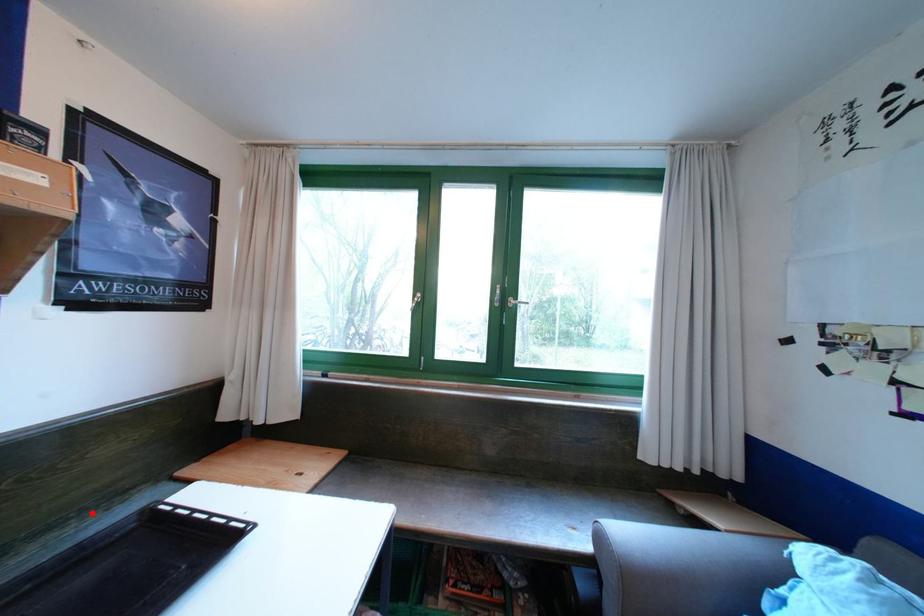
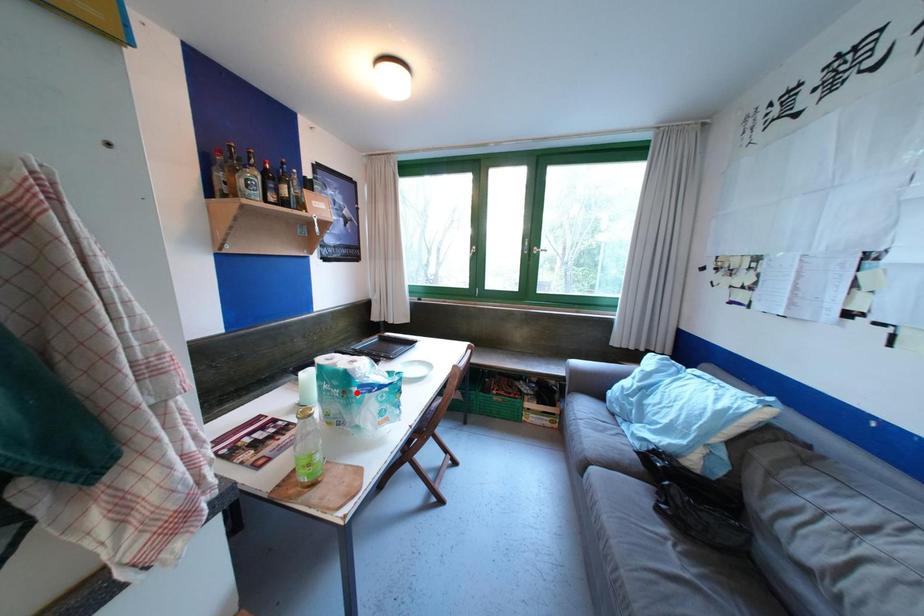
I am providing you with two images of the same scene from different viewpoints. A red point is marked on the first image and another point is marked on the second image. Is the marked point in image1 the same physical position as the marked point in image2?

No